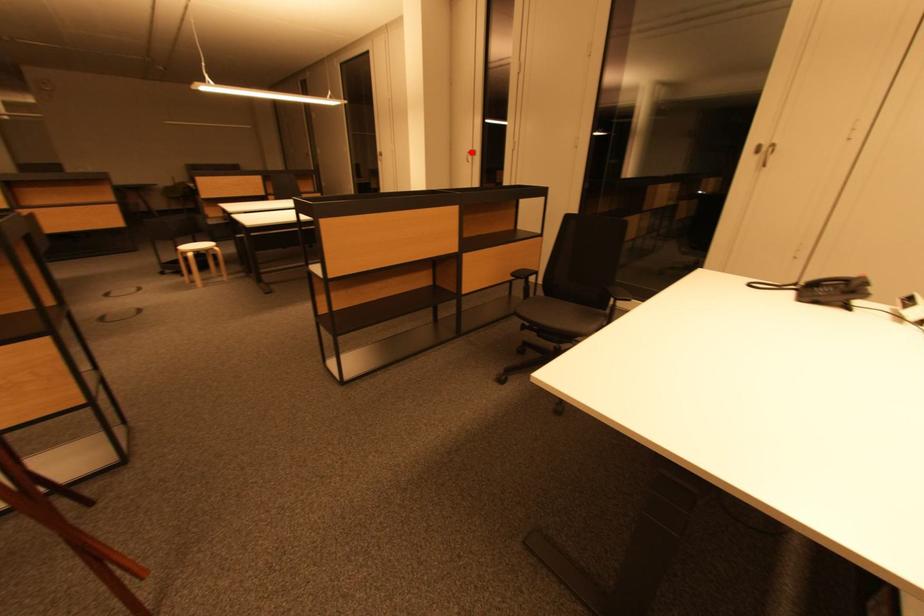
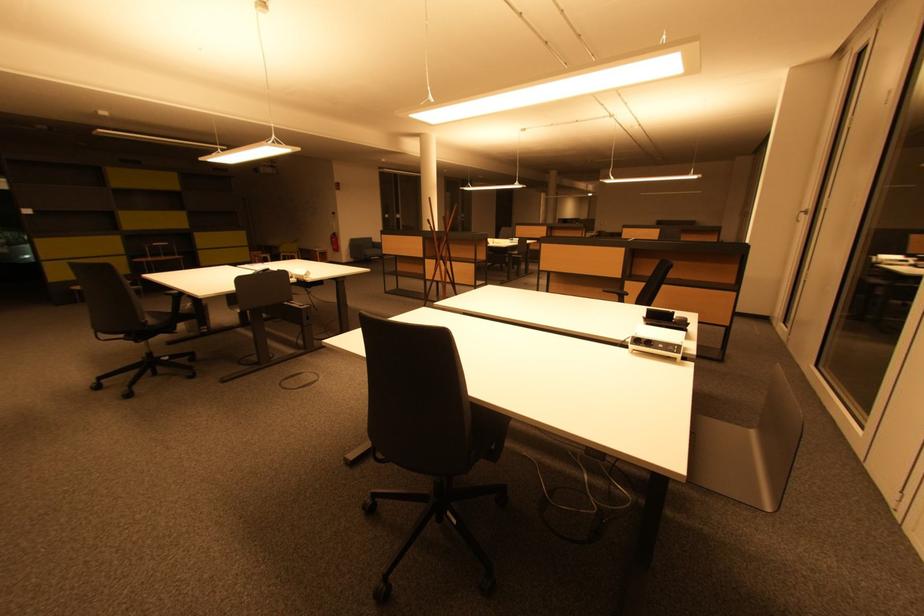
Question: I am providing you with two images of the same scene from different viewpoints. Given a red point in image1, look at the same physical point in image2. Is it:

Choices:
 (A) Closer to the viewpoint
 (B) Farther from the viewpoint

Answer: (B)